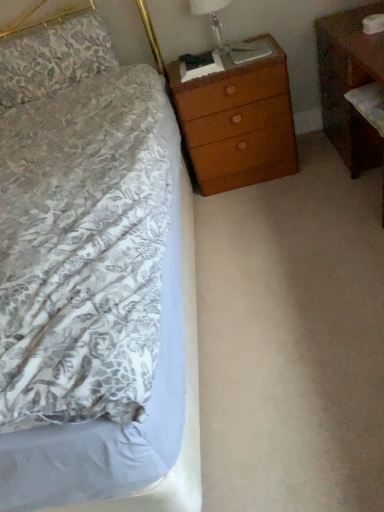
The image size is (384, 512). What do you see at coordinates (238, 123) in the screenshot?
I see `wooden chest of drawers at upper right` at bounding box center [238, 123].

What is the approximate width of brown wood nightstand at right?

It is 17.30 inches.

Where is `floral fabric pillow at upper left`? This screenshot has height=512, width=384. floral fabric pillow at upper left is located at coordinates (53, 57).

Does wooden chest of drawers at upper right have a smaller size compared to brown wood nightstand at right?

Yes.

From the image's perspective, is wooden chest of drawers at upper right beneath brown wood nightstand at right?

Actually, wooden chest of drawers at upper right appears above brown wood nightstand at right in the image.

Is wooden chest of drawers at upper right not near brown wood nightstand at right?

That's not correct — wooden chest of drawers at upper right is a little close to brown wood nightstand at right.

Could you tell me if wooden chest of drawers at upper right is turned towards brown wood nightstand at right?

No, wooden chest of drawers at upper right does not turn towards brown wood nightstand at right.

Is wooden chest of drawers at upper right facing away from floral fabric pillow at upper left?

wooden chest of drawers at upper right does not have its back to floral fabric pillow at upper left.

Who is smaller, wooden chest of drawers at upper right or floral fabric pillow at upper left?

floral fabric pillow at upper left.

Is wooden chest of drawers at upper right taller than floral fabric pillow at upper left?

Indeed, wooden chest of drawers at upper right has a greater height compared to floral fabric pillow at upper left.

Which of these two, wooden chest of drawers at upper right or floral fabric pillow at upper left, is thinner?

Thinner between the two is floral fabric pillow at upper left.

Is translucent glass lampshade at upper right wider or thinner than wooden chest of drawers at upper right?

translucent glass lampshade at upper right is thinner than wooden chest of drawers at upper right.

What's the angular difference between translucent glass lampshade at upper right and wooden chest of drawers at upper right's facing directions?

0.0791 degrees.

Is translucent glass lampshade at upper right inside the boundaries of wooden chest of drawers at upper right, or outside?

translucent glass lampshade at upper right is located beyond the bounds of wooden chest of drawers at upper right.

Find the location of `bedside lamp that appears on the right of floral fabric pillow at upper left`. bedside lamp that appears on the right of floral fabric pillow at upper left is located at coordinates (214, 21).

Is translucent glass lampshade at upper right with floral fabric pillow at upper left?

There is a gap between translucent glass lampshade at upper right and floral fabric pillow at upper left.

From the picture: How many degrees apart are the facing directions of translucent glass lampshade at upper right and floral fabric pillow at upper left?

translucent glass lampshade at upper right and floral fabric pillow at upper left are facing 0.638 degrees away from each other.

From a real-world perspective, does translucent glass lampshade at upper right stand above floral fabric pillow at upper left?

No.

Is brown wood nightstand at right inside or outside of translucent glass lampshade at upper right?

brown wood nightstand at right is not inside translucent glass lampshade at upper right, it's outside.

Does brown wood nightstand at right turn towards translucent glass lampshade at upper right?

Yes, brown wood nightstand at right is aimed at translucent glass lampshade at upper right.

Does brown wood nightstand at right have a lesser height compared to translucent glass lampshade at upper right?

No.

Locate an element on the screen. The width and height of the screenshot is (384, 512). bedside lamp on the left of brown wood nightstand at right is located at coordinates (214, 21).

Locate an element on the screen. chest of drawers below the floral fabric pillow at upper left (from a real-world perspective) is located at coordinates (238, 123).

Which object is positioned more to the right, floral fabric pillow at upper left or wooden chest of drawers at upper right?

Positioned to the right is wooden chest of drawers at upper right.

Would you say floral fabric pillow at upper left is inside or outside wooden chest of drawers at upper right?

floral fabric pillow at upper left exists outside the volume of wooden chest of drawers at upper right.

Consider the image. Considering the sizes of brown wood nightstand at right and wooden chest of drawers at upper right in the image, is brown wood nightstand at right taller or shorter than wooden chest of drawers at upper right?

In the image, brown wood nightstand at right appears to be taller than wooden chest of drawers at upper right.

Could you tell me if brown wood nightstand at right is turned towards wooden chest of drawers at upper right?

Yes, brown wood nightstand at right is turned towards wooden chest of drawers at upper right.

Between brown wood nightstand at right and wooden chest of drawers at upper right, which one has smaller size?

wooden chest of drawers at upper right is smaller.

Is brown wood nightstand at right to the left of wooden chest of drawers at upper right from the viewer's perspective?

No.

This screenshot has width=384, height=512. Find the location of `nightstand on the right of wooden chest of drawers at upper right`. nightstand on the right of wooden chest of drawers at upper right is located at coordinates (347, 88).

Locate an element on the screen. The height and width of the screenshot is (512, 384). pillow to the left of wooden chest of drawers at upper right is located at coordinates (53, 57).

Looking at the image, which one is located closer to wooden chest of drawers at upper right, translucent glass lampshade at upper right or floral fabric pillow at upper left?

translucent glass lampshade at upper right lies closer to wooden chest of drawers at upper right than the other object.

Based on the photo, which object lies nearer to the anchor point wooden chest of drawers at upper right, floral fabric pillow at upper left or brown wood nightstand at right?

The object closer to wooden chest of drawers at upper right is brown wood nightstand at right.

Looking at the image, which one is located further to brown wood nightstand at right, translucent glass lampshade at upper right or floral fabric pillow at upper left?

floral fabric pillow at upper left is positioned further to the anchor brown wood nightstand at right.

From the image, which object appears to be nearer to translucent glass lampshade at upper right, floral fabric pillow at upper left or brown wood nightstand at right?

brown wood nightstand at right.

Looking at the image, which one is located further to floral fabric pillow at upper left, wooden chest of drawers at upper right or translucent glass lampshade at upper right?

Based on the image, translucent glass lampshade at upper right appears to be further to floral fabric pillow at upper left.

Looking at the image, which one is located closer to floral fabric pillow at upper left, translucent glass lampshade at upper right or brown wood nightstand at right?

Based on the image, translucent glass lampshade at upper right appears to be nearer to floral fabric pillow at upper left.

When comparing their distances from floral fabric pillow at upper left, does brown wood nightstand at right or translucent glass lampshade at upper right seem further?

Among the two, brown wood nightstand at right is located further to floral fabric pillow at upper left.

Based on their spatial positions, is wooden chest of drawers at upper right or brown wood nightstand at right further from translucent glass lampshade at upper right?

brown wood nightstand at right is further to translucent glass lampshade at upper right.

Find the location of a particular element. This screenshot has width=384, height=512. the chest of drawers located between translucent glass lampshade at upper right and brown wood nightstand at right in the left-right direction is located at coordinates (238, 123).

Where is `the chest of drawers located between floral fabric pillow at upper left and brown wood nightstand at right in the left-right direction`? the chest of drawers located between floral fabric pillow at upper left and brown wood nightstand at right in the left-right direction is located at coordinates (238, 123).

The width and height of the screenshot is (384, 512). I want to click on bedside lamp between floral fabric pillow at upper left and wooden chest of drawers at upper right, so click(214, 21).

Find the location of a particular element. bedside lamp located between floral fabric pillow at upper left and brown wood nightstand at right in the left-right direction is located at coordinates (214, 21).